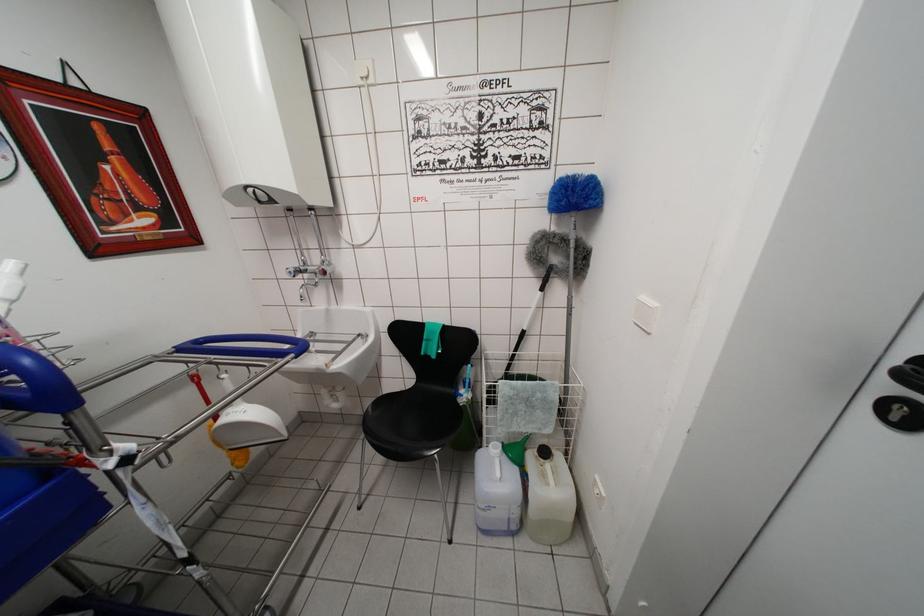
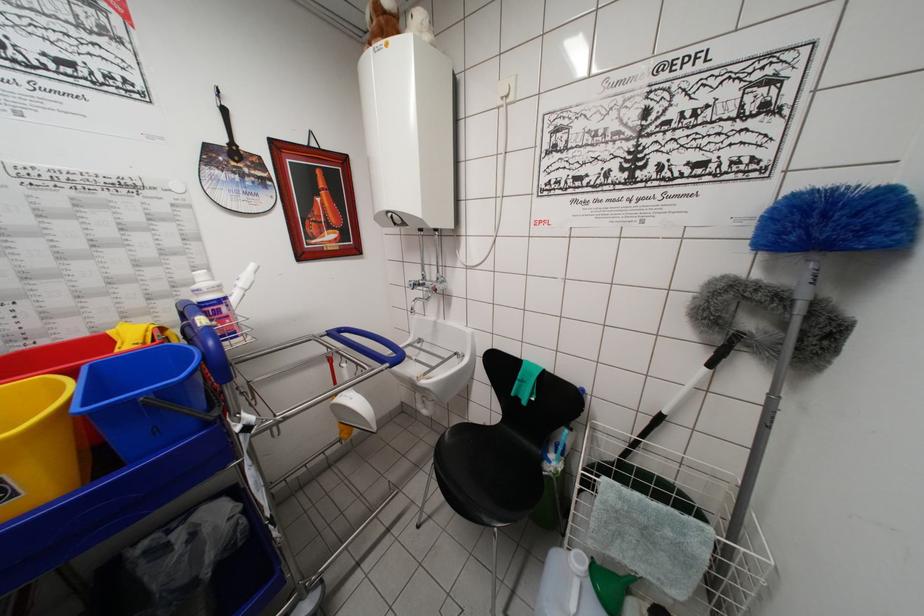
Find the pixel in the second image that matches point (493, 450) in the first image.

(576, 557)